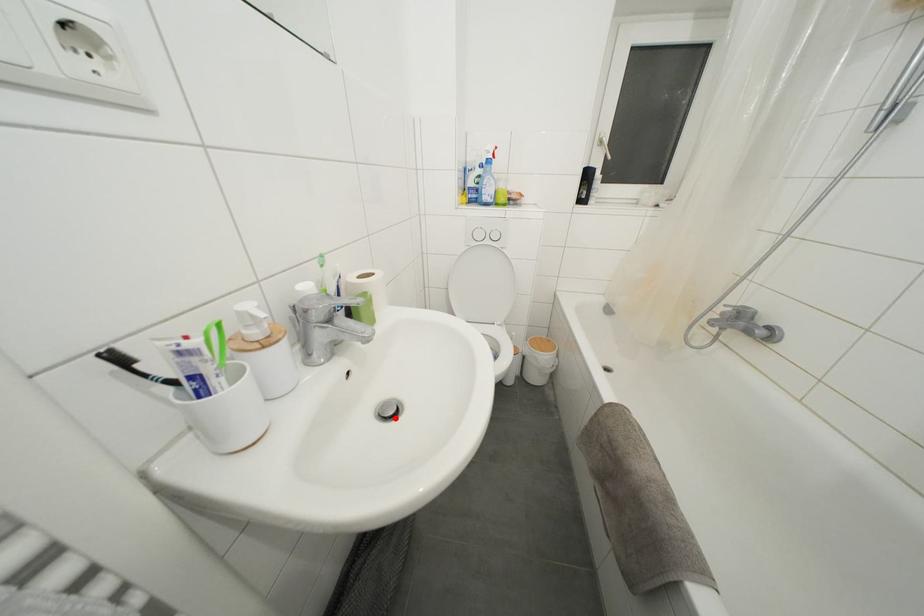
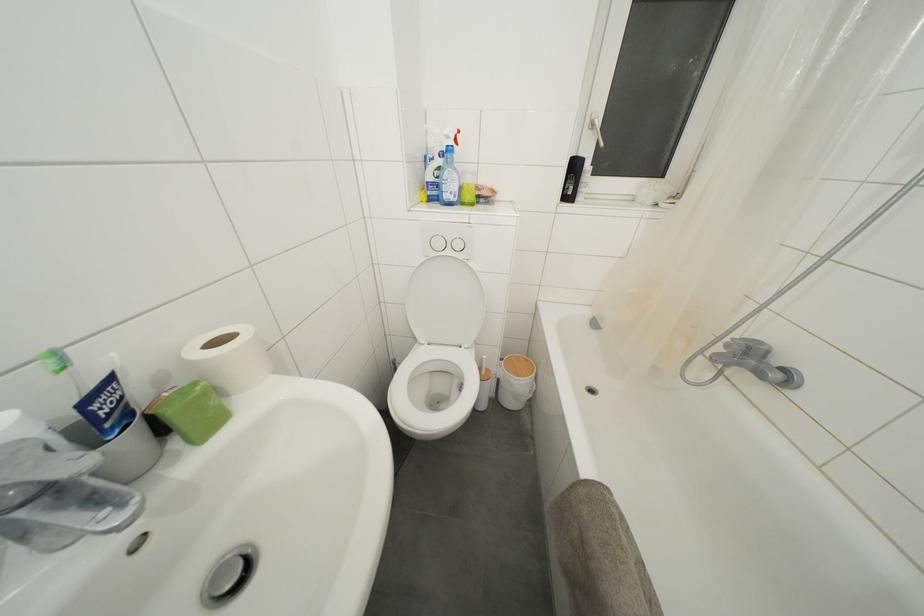
Find the pixel in the second image that matches the highlighted location in the first image.

(233, 592)